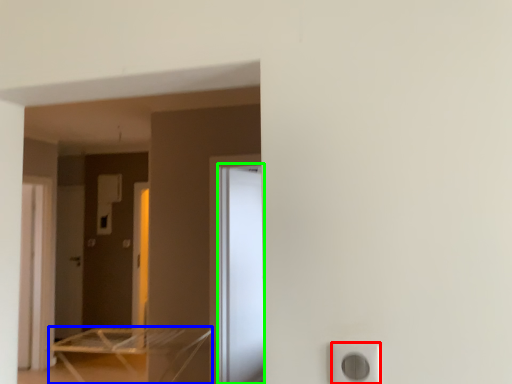
Question: Which is nearer to the electric outlet (highlighted by a red box)? furniture (highlighted by a blue box) or screen door (highlighted by a green box).

Choices:
 (A) furniture
 (B) screen door

Answer: (B)